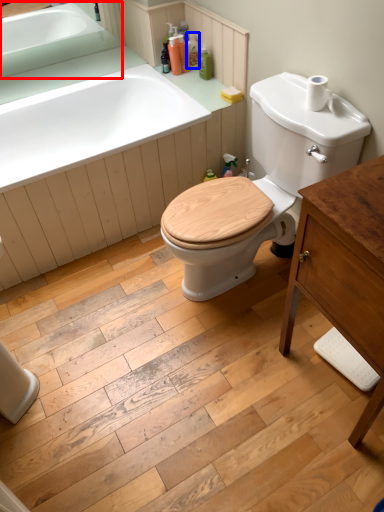
Question: Which point is further to the camera, sink (highlighted by a red box) or toiletry (highlighted by a blue box)?

Choices:
 (A) sink
 (B) toiletry

Answer: (B)